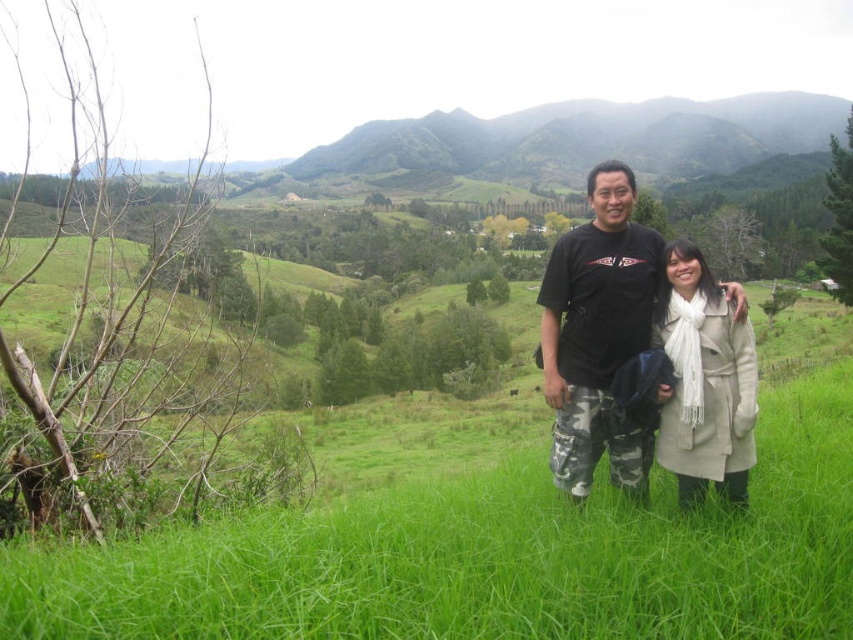
Question: Can you confirm if camouflage pants at center is bigger than beige wool coat at center?

Choices:
 (A) no
 (B) yes

Answer: (B)

Question: Can you confirm if camouflage pants at center is positioned below beige wool coat at center?

Choices:
 (A) yes
 (B) no

Answer: (B)

Question: Among these points, which one is nearest to the camera?

Choices:
 (A) [x=546, y=365]
 (B) [x=672, y=285]

Answer: (B)

Question: Is camouflage pants at center bigger than beige wool coat at center?

Choices:
 (A) no
 (B) yes

Answer: (B)